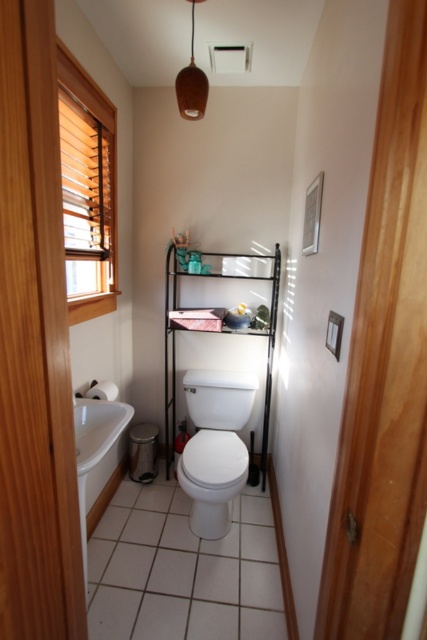
What do you see at coordinates (215, 445) in the screenshot? I see `white glossy toilet at center` at bounding box center [215, 445].

Who is taller, white glossy toilet at center or white glossy sink at lower left?

white glossy toilet at center

What are the coordinates of `white glossy toilet at center` in the screenshot? It's located at (215, 445).

You are a GUI agent. You are given a task and a screenshot of the screen. Output one action in this format:
    pyautogui.click(x=<x>, y=<y>)
    Task: Click on the white glossy toilet at center
    This screenshot has height=640, width=427.
    Given the screenshot: What is the action you would take?
    pyautogui.click(x=215, y=445)